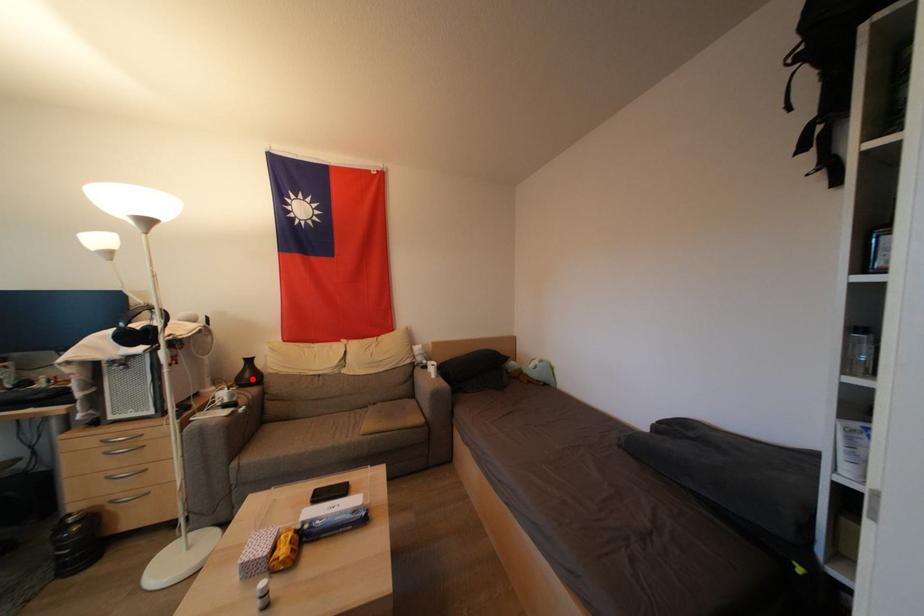
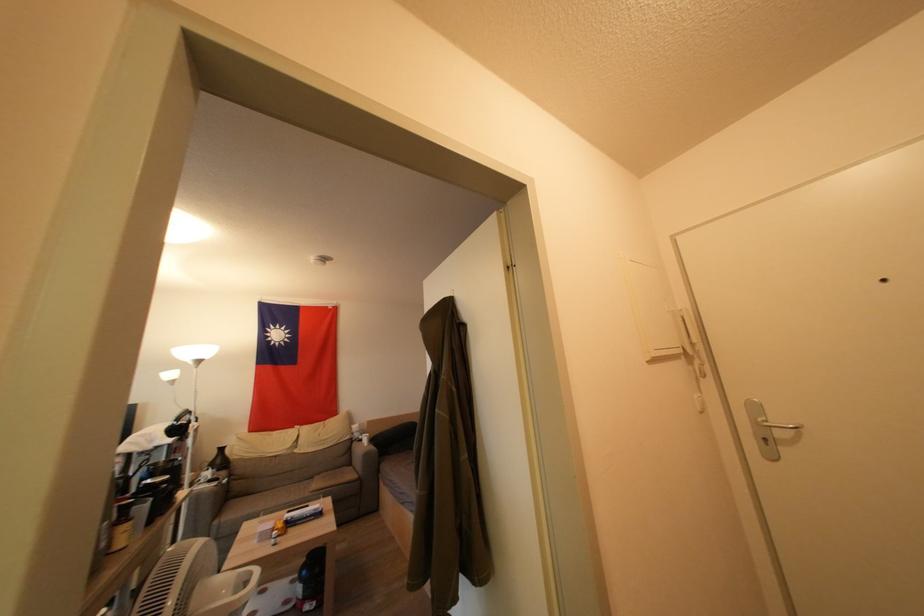
The point at the highlighted location is marked in the first image. Where is the corresponding point in the second image?

(224, 464)